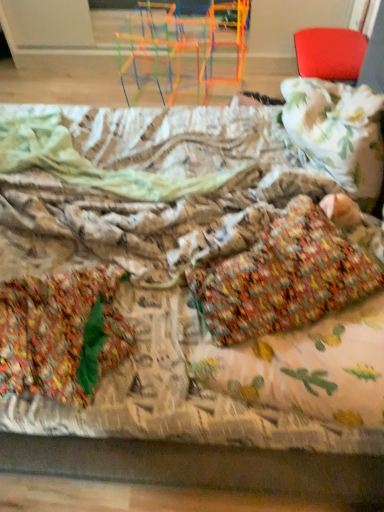
What do you see at coordinates (330, 53) in the screenshot?
I see `matte red chair at upper right` at bounding box center [330, 53].

Where is `matte red chair at upper right`? matte red chair at upper right is located at coordinates click(330, 53).

Measure the distance between matte red chair at upper right and camera.

The depth of matte red chair at upper right is 1.88 meters.

The height and width of the screenshot is (512, 384). I want to click on matte red chair at upper right, so [x=330, y=53].